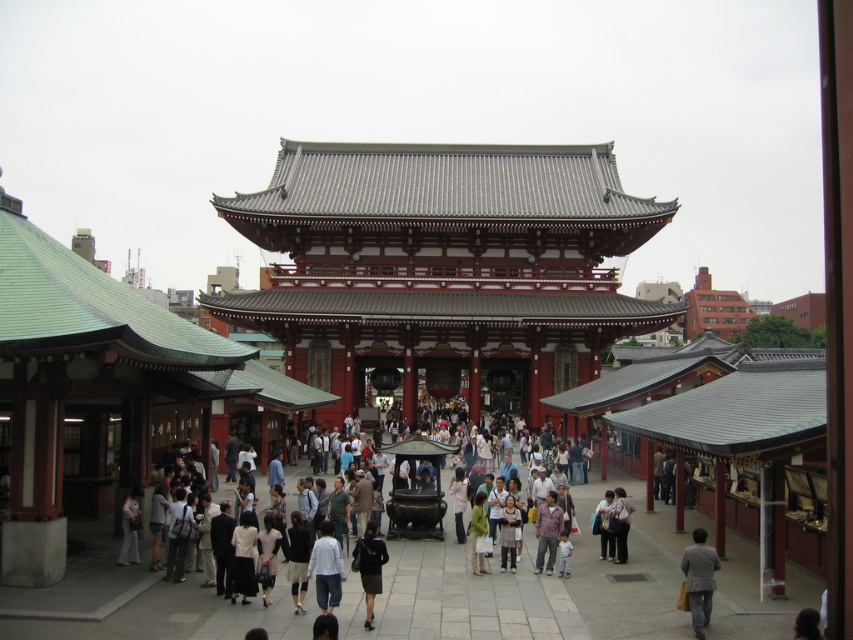
Looking at this image, you are a visitor at the temple and want to take a photo of both the red lacquered temple gate at center and the black fabric skirt at center. Since you want both to be clearly visible in the frame, which object should you focus on first to ensure it fits properly?

The red lacquered temple gate at center is larger in size than the black fabric skirt at center, so you should focus on framing the red lacquered temple gate at center first to ensure it fits in the photo, and then adjust the angle to include the black fabric skirt at center.

You are a photographer at the temple and want to capture both the white cotton shirt at center and the black fabric skirt at center in a single photo. Which clothing item is located to the left of the other?

The white cotton shirt at center is positioned on the left side of black fabric skirt at center.

You are a photographer planning to capture the entire view of the red lacquered temple gate at center and the black fabric skirt at center in a single frame. Given that your camera has a fixed field of view, which object should you position closer to the center of the frame to ensure both are fully visible?

You should position the red lacquered temple gate at center closer to the center of the frame because its width surpasses that of the black fabric skirt at center, making it larger and requiring more space in the composition.